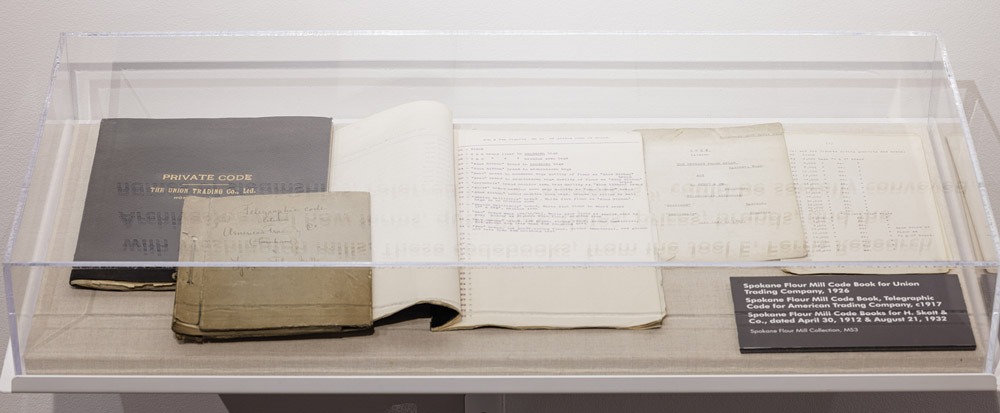
The width and height of the screenshot is (1000, 413). I want to click on open notebook, so click(x=546, y=290).